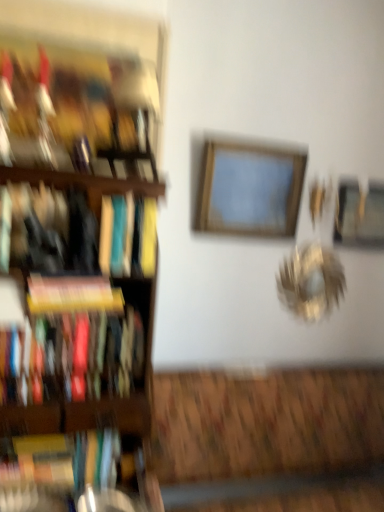
Describe the element at coordinates (65, 473) in the screenshot. This screenshot has width=384, height=512. I see `hardcover book at left, acting as the first book starting from the bottom` at that location.

Describe the element at coordinates (71, 357) in the screenshot. I see `matte hardcover book at left, the second book in the bottom-to-top sequence` at that location.

What do you see at coordinates (248, 189) in the screenshot? The height and width of the screenshot is (512, 384). I see `wooden frame at center, placed as the second picture frame when sorted from right to left` at bounding box center [248, 189].

Find the location of a particular element. The width and height of the screenshot is (384, 512). metallic gold picture frame at upper right, the 1th picture frame from the right is located at coordinates (359, 215).

Is matte hardcover book at left, the second book in the bottom-to-top sequence, closer to camera compared to wooden bookshelf at left?

That is False.

Is point (11, 330) closer or farther from the camera than point (25, 75)?

Point (11, 330) is closer to the camera than point (25, 75).

Considering the sizes of objects matte hardcover book at left, the second book in the bottom-to-top sequence, and wooden bookshelf at left in the image provided, who is bigger, matte hardcover book at left, the second book in the bottom-to-top sequence, or wooden bookshelf at left?

wooden bookshelf at left.

Between metallic gold picture frame at upper right, the 1th picture frame from the right, and yellow matte book at left, the third book when ordered from top to bottom, which one has less height?

With less height is yellow matte book at left, the third book when ordered from top to bottom.

Looking at the image, does metallic gold picture frame at upper right, the 1th picture frame from the right, seem bigger or smaller compared to yellow matte book at left, the third book when ordered from top to bottom?

Considering their sizes, metallic gold picture frame at upper right, the 1th picture frame from the right, takes up more space than yellow matte book at left, the third book when ordered from top to bottom.

Is point (365, 239) behind point (104, 295)?

Yes, point (365, 239) is behind point (104, 295).

From a real-world perspective, which is physically above, metallic gold picture frame at upper right, placed as the second picture frame when sorted from front to back, or yellow matte book at left, acting as the third book starting from the bottom?

metallic gold picture frame at upper right, placed as the second picture frame when sorted from front to back, is physically above.

Could you tell me if matte hardcover book at left, the second book in the bottom-to-top sequence, is turned towards black matte bookshelf at left, the 4th book ordered from the bottom?

No, matte hardcover book at left, the second book in the bottom-to-top sequence, is not aimed at black matte bookshelf at left, the 4th book ordered from the bottom.

Based on the photo, considering the relative sizes of matte hardcover book at left, which is the 4th book from top to bottom, and black matte bookshelf at left, acting as the 2th book starting from the top, in the image provided, is matte hardcover book at left, which is the 4th book from top to bottom, wider than black matte bookshelf at left, acting as the 2th book starting from the top,?

Incorrect, the width of matte hardcover book at left, which is the 4th book from top to bottom, does not surpass that of black matte bookshelf at left, acting as the 2th book starting from the top.

Is matte hardcover book at left, which is the 4th book from top to bottom, located outside black matte bookshelf at left, the 4th book ordered from the bottom?

That's correct, matte hardcover book at left, which is the 4th book from top to bottom, is outside of black matte bookshelf at left, the 4th book ordered from the bottom.

Is black matte bookshelf at left, acting as the 2th book starting from the top, taller or shorter than hardcover book at left, the first book positioned from the top?

black matte bookshelf at left, acting as the 2th book starting from the top, is shorter than hardcover book at left, the first book positioned from the top.

From a real-world perspective, is black matte bookshelf at left, acting as the 2th book starting from the top, under hardcover book at left, the first book positioned from the top?

Yes, from a real-world perspective, black matte bookshelf at left, acting as the 2th book starting from the top, is below hardcover book at left, the first book positioned from the top.

Choose the correct answer: Is black matte bookshelf at left, the 4th book ordered from the bottom, inside hardcover book at left, the first book positioned from the top, or outside it?

black matte bookshelf at left, the 4th book ordered from the bottom, is not inside hardcover book at left, the first book positioned from the top, it's outside.

Can you confirm if black matte bookshelf at left, acting as the 2th book starting from the top, is smaller than hardcover book at left, the first book positioned from the top?

Incorrect, black matte bookshelf at left, acting as the 2th book starting from the top, is not smaller in size than hardcover book at left, the first book positioned from the top.

From a real-world perspective, is hardcover book at left, acting as the first book starting from the bottom, physically located above or below hardcover book at left, which ranks as the fifth book in bottom-to-top order?

hardcover book at left, acting as the first book starting from the bottom, is situated lower than hardcover book at left, which ranks as the fifth book in bottom-to-top order, in the real world.

Does hardcover book at left, positioned as the fifth book in top-to-bottom order, have a larger size compared to hardcover book at left, which ranks as the fifth book in bottom-to-top order?

No, hardcover book at left, positioned as the fifth book in top-to-bottom order, is not bigger than hardcover book at left, which ranks as the fifth book in bottom-to-top order.

Is hardcover book at left, positioned as the fifth book in top-to-bottom order, taller than hardcover book at left, the first book positioned from the top?

Incorrect, the height of hardcover book at left, positioned as the fifth book in top-to-bottom order, is not larger of that of hardcover book at left, the first book positioned from the top.

I want to click on book that is the 4th one when counting upward from the hardcover book at left, positioned as the fifth book in top-to-bottom order (from the image's perspective), so click(74, 108).

From the picture: Which object is wider, black matte bookshelf at left, acting as the 2th book starting from the top, or wooden bookshelf at left?

wooden bookshelf at left.

Is wooden bookshelf at left at the back of black matte bookshelf at left, the 4th book ordered from the bottom?

Yes, black matte bookshelf at left, the 4th book ordered from the bottom, is facing away from wooden bookshelf at left.

Could wooden bookshelf at left be considered to be inside black matte bookshelf at left, the 4th book ordered from the bottom?

Actually, wooden bookshelf at left is outside black matte bookshelf at left, the 4th book ordered from the bottom.

Starting from the black matte bookshelf at left, acting as the 2th book starting from the top, which picture frame is the 1st one to the right? Please provide its 2D coordinates.

[(248, 189)]

Looking at this image, considering the sizes of wooden frame at center, the 1th picture frame in the front-to-back sequence, and black matte bookshelf at left, the 4th book ordered from the bottom, in the image, is wooden frame at center, the 1th picture frame in the front-to-back sequence, taller or shorter than black matte bookshelf at left, the 4th book ordered from the bottom,?

In the image, wooden frame at center, the 1th picture frame in the front-to-back sequence, appears to be taller than black matte bookshelf at left, the 4th book ordered from the bottom.

Which is closer to the camera, (x=273, y=231) or (x=63, y=204)?

Point (x=273, y=231).

What's the angular difference between wooden frame at center, the first picture frame in the left-to-right sequence, and black matte bookshelf at left, acting as the 2th book starting from the top,'s facing directions?

The angular difference between wooden frame at center, the first picture frame in the left-to-right sequence, and black matte bookshelf at left, acting as the 2th book starting from the top, is 2.54 degrees.

I want to click on shelf located in front of the matte hardcover book at left, the second book in the bottom-to-top sequence, so click(x=78, y=215).

I want to click on the 2nd book below the metallic gold picture frame at upper right, the 1th picture frame from the right (from a real-world perspective), so click(73, 295).

Based on their spatial positions, is metallic gold picture frame at upper right, the second picture frame when ordered from left to right, or hardcover book at left, which ranks as the fifth book in bottom-to-top order, closer to wooden bookshelf at left?

hardcover book at left, which ranks as the fifth book in bottom-to-top order, is positioned closer to the anchor wooden bookshelf at left.

When comparing their distances from matte hardcover book at left, the second book in the bottom-to-top sequence, does yellow matte book at left, the third book when ordered from top to bottom, or wooden frame at center, placed as the second picture frame when sorted from right to left, seem closer?

yellow matte book at left, the third book when ordered from top to bottom, is positioned closer to the anchor matte hardcover book at left, the second book in the bottom-to-top sequence.

Based on their spatial positions, is wooden bookshelf at left or black matte bookshelf at left, acting as the 2th book starting from the top, further from hardcover book at left, positioned as the fifth book in top-to-bottom order?

black matte bookshelf at left, acting as the 2th book starting from the top.

Which object lies nearer to the anchor point yellow matte book at left, acting as the third book starting from the bottom, wooden frame at center, which is the 2th picture frame from back to front, or hardcover book at left, positioned as the fifth book in top-to-bottom order?

Among the two, hardcover book at left, positioned as the fifth book in top-to-bottom order, is located nearer to yellow matte book at left, acting as the third book starting from the bottom.

Looking at the image, which one is located further to black matte bookshelf at left, the 4th book ordered from the bottom, hardcover book at left, which ranks as the fifth book in bottom-to-top order, or hardcover book at left, acting as the first book starting from the bottom?

Among the two, hardcover book at left, acting as the first book starting from the bottom, is located further to black matte bookshelf at left, the 4th book ordered from the bottom.

Estimate the real-world distances between objects in this image. Which object is closer to yellow matte book at left, the third book when ordered from top to bottom, wooden frame at center, placed as the second picture frame when sorted from right to left, or hardcover book at left, the first book positioned from the top?

hardcover book at left, the first book positioned from the top.

Estimate the real-world distances between objects in this image. Which object is further from hardcover book at left, positioned as the fifth book in top-to-bottom order, metallic gold picture frame at upper right, the 1th picture frame from the right, or wooden frame at center, which is the 2th picture frame from back to front?

metallic gold picture frame at upper right, the 1th picture frame from the right, is further to hardcover book at left, positioned as the fifth book in top-to-bottom order.

When comparing their distances from wooden frame at center, the 1th picture frame in the front-to-back sequence, does hardcover book at left, the first book positioned from the top, or hardcover book at left, acting as the first book starting from the bottom, seem closer?

hardcover book at left, the first book positioned from the top.

What are the coordinates of `book between hardcover book at left, the first book positioned from the top, and yellow matte book at left, the third book when ordered from top to bottom, vertically` in the screenshot? It's located at (45, 229).

Identify the location of book that lies between black matte bookshelf at left, the 4th book ordered from the bottom, and matte hardcover book at left, which is the 4th book from top to bottom, from top to bottom. (73, 295).

Identify the location of picture frame situated between yellow matte book at left, acting as the third book starting from the bottom, and metallic gold picture frame at upper right, placed as the second picture frame when sorted from front to back, from left to right. Image resolution: width=384 pixels, height=512 pixels. [x=248, y=189].

Where is `shelf between hardcover book at left, the first book positioned from the top, and hardcover book at left, positioned as the fifth book in top-to-bottom order, in the up-down direction`? shelf between hardcover book at left, the first book positioned from the top, and hardcover book at left, positioned as the fifth book in top-to-bottom order, in the up-down direction is located at coordinates coord(78,215).